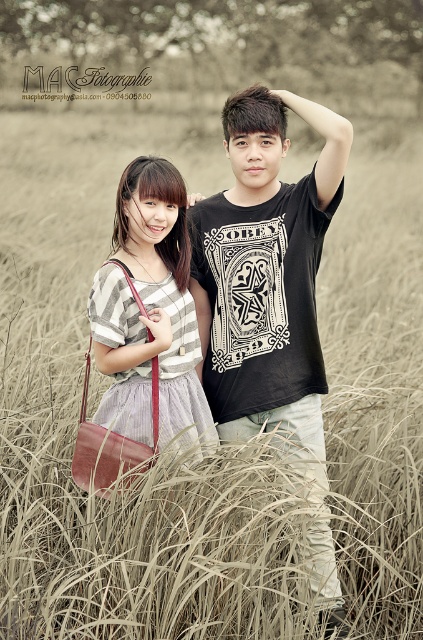
You are taking a photo of two points in the image. The first point is labeled as point (246,160) and the second is point (178,196). If you want to focus on the point that is closer to the camera, which coordinate should you select?

Point (178,196) is closer to the camera than point (246,160), so you should select point (178,196) to focus on.